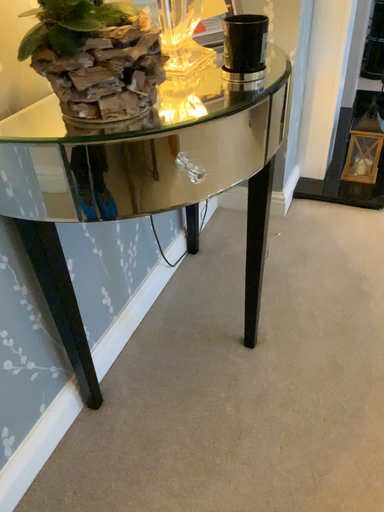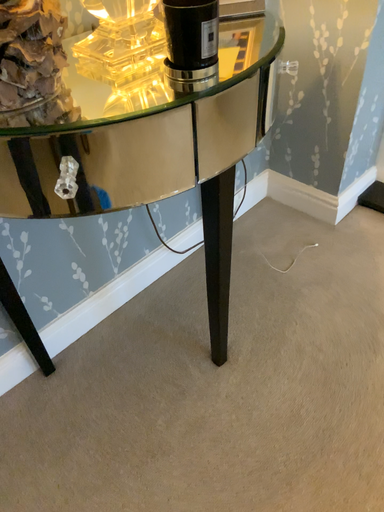
Question: How did the camera likely rotate when shooting the video?

Choices:
 (A) rotated right
 (B) rotated left

Answer: (B)